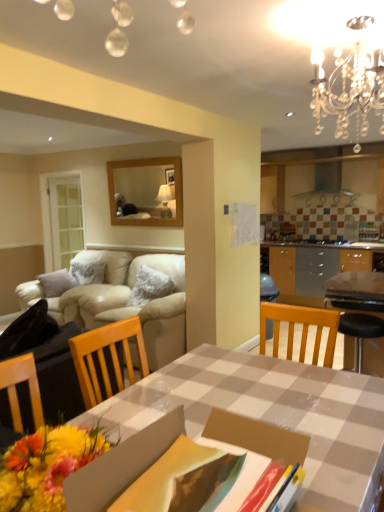
The image size is (384, 512). In order to click on vacant area on top of checkered fabric table at center (from a real-world perspective) in this screenshot , I will do `click(251, 391)`.